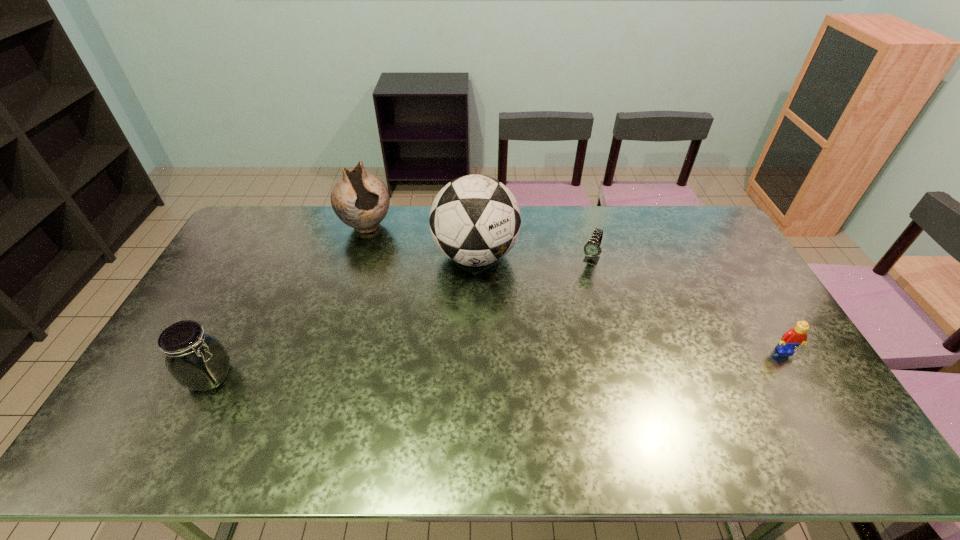
Where is `vacant spot on the desktop that is between the nearest object and the Lego and is positioned on the surface of the soccer ball where the brand logo is visible`? The width and height of the screenshot is (960, 540). vacant spot on the desktop that is between the nearest object and the Lego and is positioned on the surface of the soccer ball where the brand logo is visible is located at coordinates (473, 364).

I want to click on free space on the desktop that is between the nearest object and the Lego and is positioned from the spout of the fourth object from right to left, so click(442, 366).

You are a GUI agent. You are given a task and a screenshot of the screen. Output one action in this format:
    pyautogui.click(x=<x>, y=<y>)
    Task: Click on the free space on the desktop that is between the third shortest object and the second nearest object and is positioned on the face of the second object from right to left
    The image size is (960, 540).
    Given the screenshot: What is the action you would take?
    pyautogui.click(x=543, y=361)